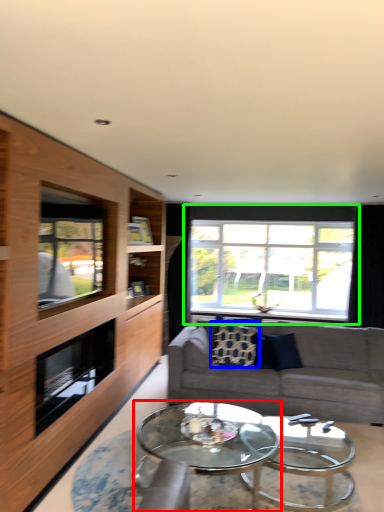
Question: Which is farther away from coffee table (highlighted by a red box)? pillow (highlighted by a blue box) or window (highlighted by a green box)?

Choices:
 (A) pillow
 (B) window

Answer: (B)